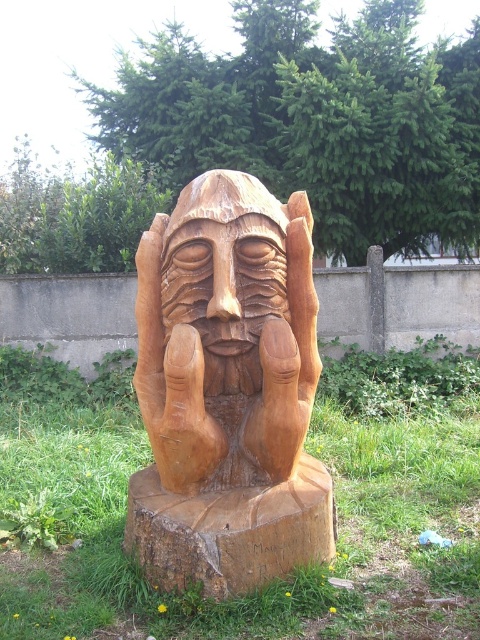
Question: Which object is closer to the camera taking this photo?

Choices:
 (A) green grass at center
 (B) wooden carved face at center
 (C) natural wood carving at center

Answer: (A)

Question: Estimate the real-world distances between objects in this image. Which object is farther from the wooden carved face at center?

Choices:
 (A) green grass at center
 (B) natural wood carving at center

Answer: (A)

Question: Among these points, which one is farthest from the camera?

Choices:
 (A) (408, 630)
 (B) (263, 216)

Answer: (B)

Question: Considering the relative positions of green grass at center and wooden carved face at center in the image provided, where is green grass at center located with respect to wooden carved face at center?

Choices:
 (A) below
 (B) above

Answer: (A)

Question: Does green grass at center have a smaller size compared to wooden carved face at center?

Choices:
 (A) no
 (B) yes

Answer: (A)

Question: Is green grass at center to the right of wooden carved face at center from the viewer's perspective?

Choices:
 (A) no
 (B) yes

Answer: (A)